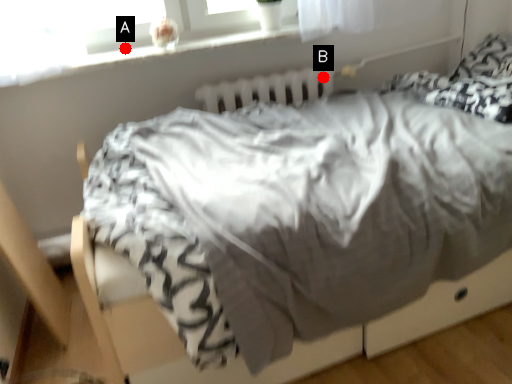
Question: Two points are circled on the image, labeled by A and B beside each circle. Which of the following is the farthest from the observer?

Choices:
 (A) A is further
 (B) B is further

Answer: (B)